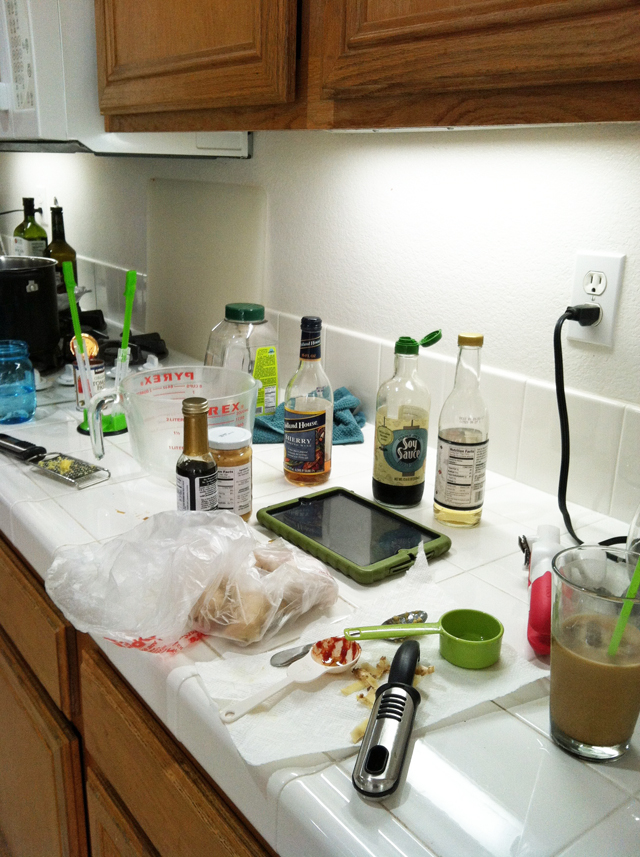
At what (x,y) coordinates should I click in order to perform the action: click on white electrical outlet. Please return your answer as a coordinate pair (x, y). Image resolution: width=640 pixels, height=857 pixels. Looking at the image, I should click on (611, 294).